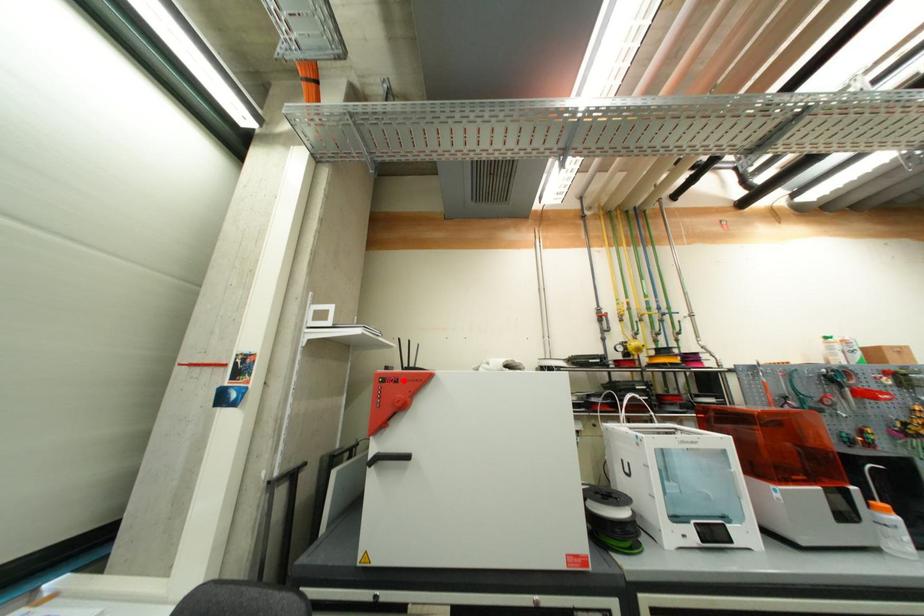
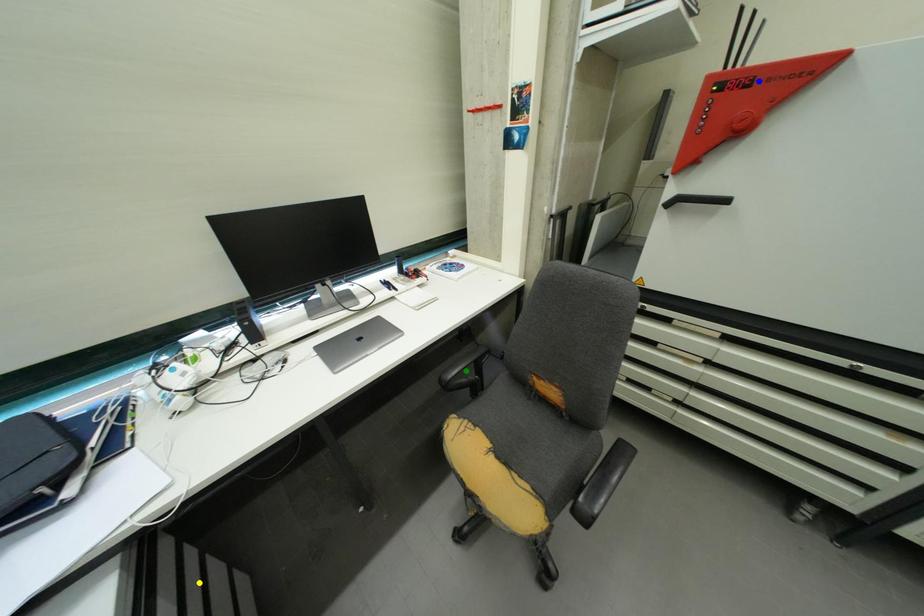
Question: I am providing you with two images of the same scene from different viewpoints. A red point is marked on the first image. You are given multiple points on the second image. Which mark in image 2 goes with the point in image 1?

Choices:
 (A) yellow point
 (B) blue point
 (C) green point

Answer: (B)